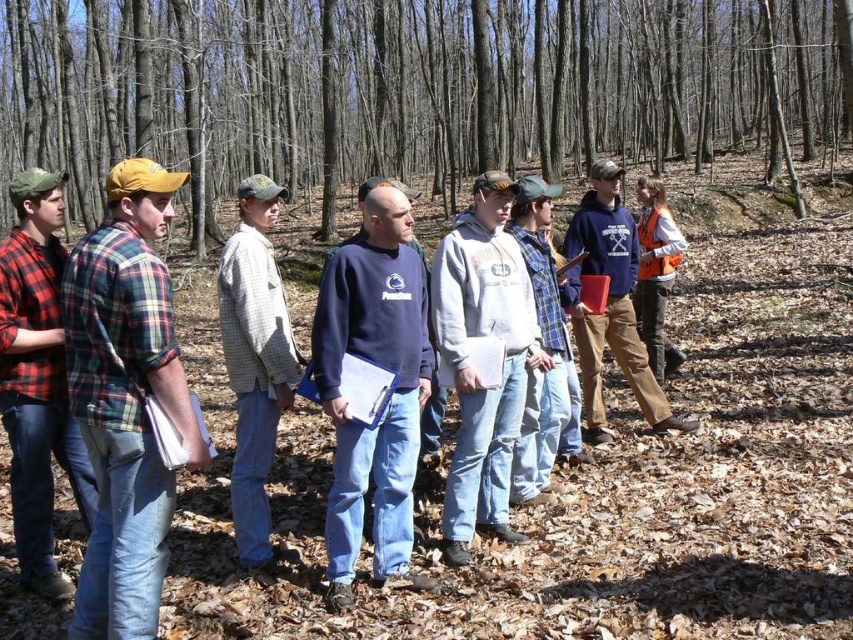
Measure the distance from plaid flannel shirt at left to dark blue fleece sweatshirt at center.

3.55 feet

Is plaid flannel shirt at left below dark blue fleece sweatshirt at center?

Yes, plaid flannel shirt at left is below dark blue fleece sweatshirt at center.

Locate an element on the screen. The height and width of the screenshot is (640, 853). plaid flannel shirt at left is located at coordinates (126, 400).

From the picture: Which is below, brown bark tree at center or light brown plaid shirt at center?

light brown plaid shirt at center is lower down.

Describe the element at coordinates (405, 86) in the screenshot. I see `brown bark tree at center` at that location.

Does point (178, 92) lie behind point (254, 193)?

Yes, it is behind point (254, 193).

The image size is (853, 640). I want to click on brown bark tree at center, so click(x=405, y=86).

Between brown bark tree at center and dark blue fleece sweatshirt at center, which one has less height?

dark blue fleece sweatshirt at center

Does point (450, 157) come farther from viewer compared to point (376, 488)?

Yes, point (450, 157) is behind point (376, 488).

Find the location of `brown bark tree at center`. brown bark tree at center is located at coordinates (405, 86).